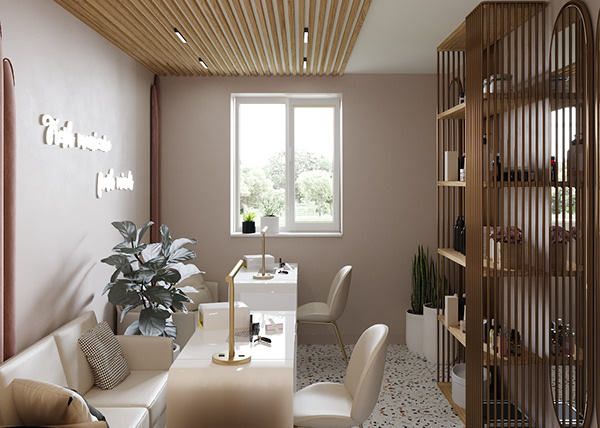
The height and width of the screenshot is (428, 600). I want to click on ceiling light, so click(180, 37), click(201, 61), click(305, 35), click(304, 64).